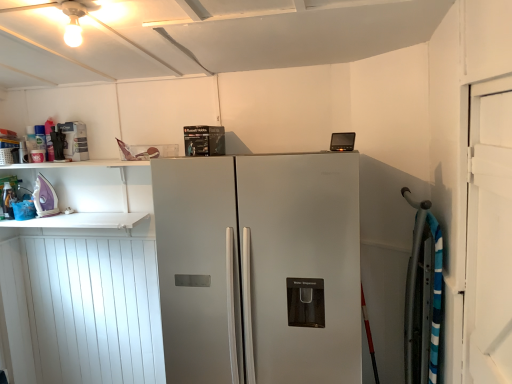
The height and width of the screenshot is (384, 512). What are the coordinates of `free space in front of purple glossy iron at left, which is the 2th appliance from top to bottom` in the screenshot? It's located at (34, 221).